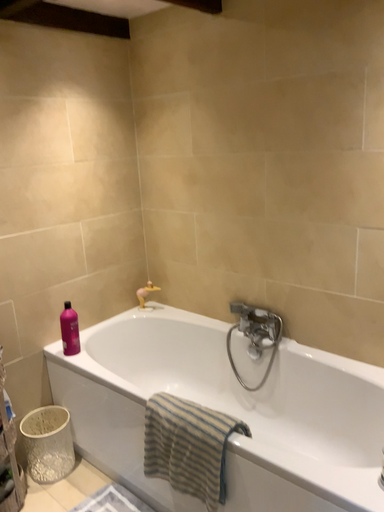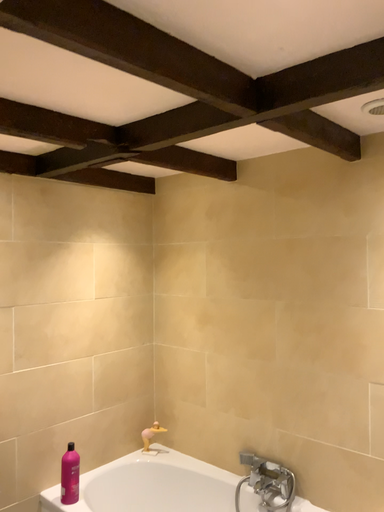
Question: How did the camera likely rotate when shooting the video?

Choices:
 (A) rotated upward
 (B) rotated downward

Answer: (A)